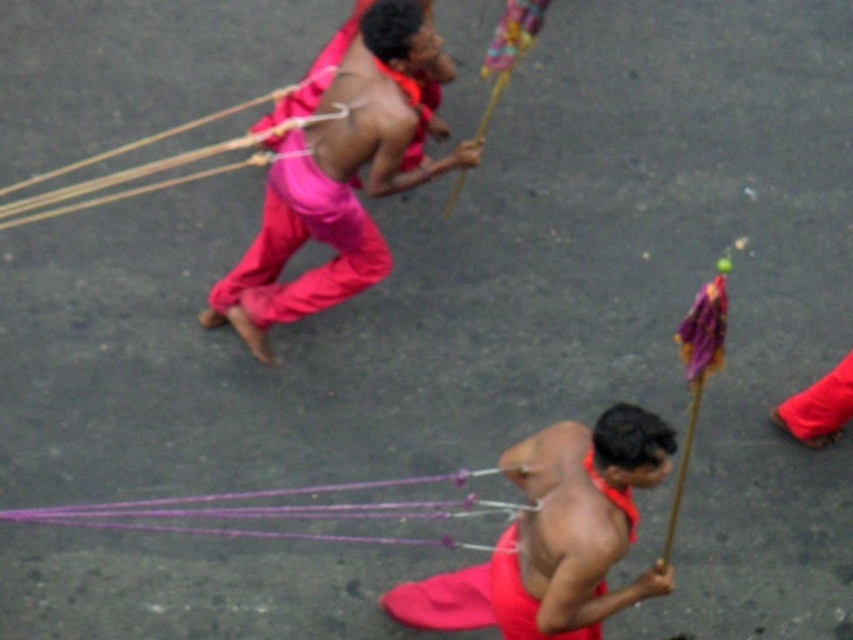
Between point (360, 224) and point (55, 515), which one is positioned behind?

The point (360, 224) is more distant.

Between point (254, 285) and point (283, 493), which one is positioned behind?

The point (254, 285) is more distant.

This screenshot has height=640, width=853. I want to click on matte pink pants at upper center, so click(338, 180).